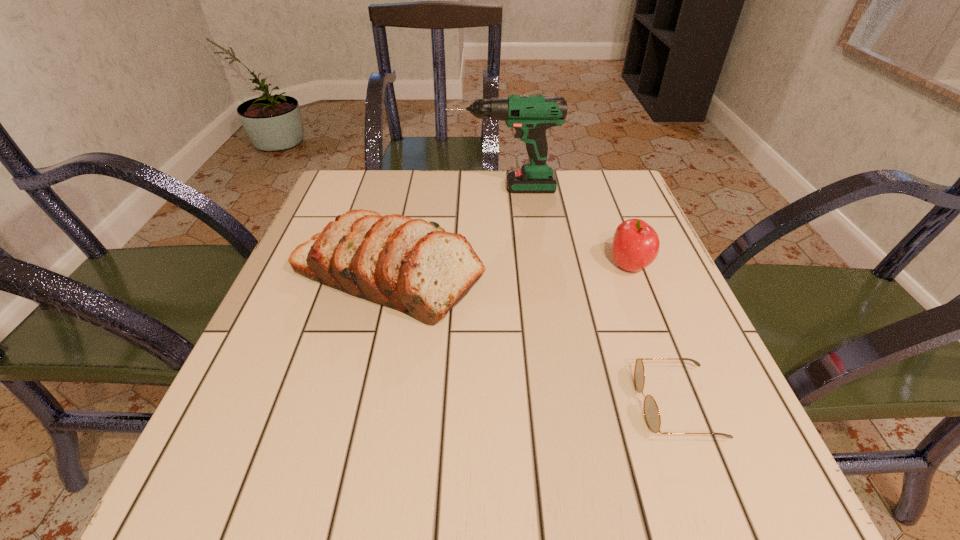
What are the coordinates of `vacant space at the right edge of the desktop` in the screenshot? It's located at (592, 262).

In the image, there is a desktop. In order to click on blank space at the far left corner in this screenshot , I will do click(x=343, y=180).

Image resolution: width=960 pixels, height=540 pixels. Identify the location of free space at the near left corner. (198, 509).

The image size is (960, 540). In the image, there is a desktop. In order to click on blank space at the far right corner in this screenshot , I will do `click(612, 173)`.

Find the location of a particular element. free spot between the apple and the drill is located at coordinates (566, 227).

You are a GUI agent. You are given a task and a screenshot of the screen. Output one action in this format:
    pyautogui.click(x=<x>, y=<y>)
    Task: Click on the free space that is in between the apple and the bread
    
    Given the screenshot: What is the action you would take?
    pyautogui.click(x=509, y=271)

Find the location of a particular element. The height and width of the screenshot is (540, 960). empty space that is in between the apple and the shortest object is located at coordinates (653, 335).

This screenshot has width=960, height=540. Identify the location of vacant area that lies between the apple and the farthest object. (566, 227).

Identify the location of free space between the farthest object and the sunglasses. The height and width of the screenshot is (540, 960). (589, 296).

Where is `free space between the nearest object and the tallest object`? free space between the nearest object and the tallest object is located at coordinates (589, 296).